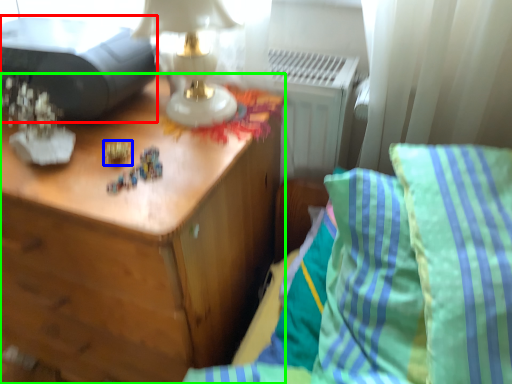
Question: Based on their relative distances, which object is farther from printer (highlighted by a red box)? Choose from toy (highlighted by a blue box) and nightstand (highlighted by a green box).

Choices:
 (A) toy
 (B) nightstand

Answer: (B)